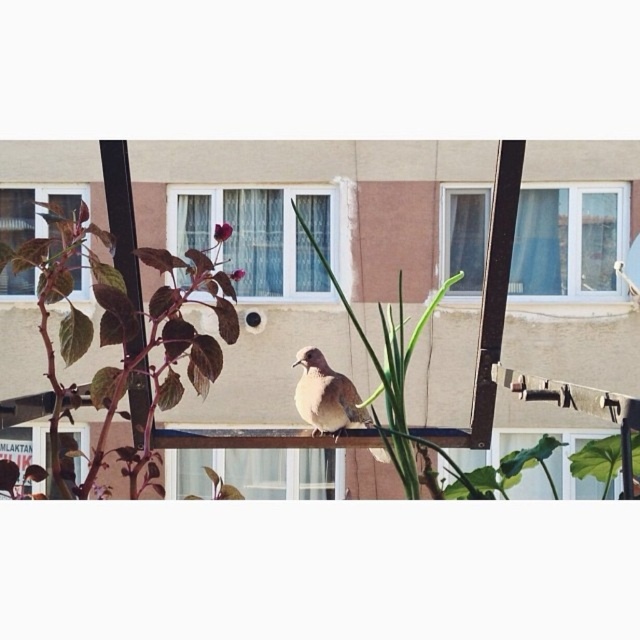
The height and width of the screenshot is (640, 640). What do you see at coordinates (120, 339) in the screenshot? I see `shiny purple leaves at left` at bounding box center [120, 339].

Between point (102, 296) and point (392, 394), which one is positioned in front?

Point (102, 296)

The height and width of the screenshot is (640, 640). I want to click on shiny purple leaves at left, so tap(120, 339).

Does point (218, 372) come closer to viewer compared to point (342, 397)?

That is True.

Does point (81, 234) lie behind point (305, 412)?

No, it is not.

Image resolution: width=640 pixels, height=640 pixels. I want to click on shiny purple leaves at left, so 120,339.

Which is behind, point (364, 336) or point (333, 413)?

The point (333, 413) is behind.

Can you confirm if green leafy plant at center is taller than brown speckled bird at center?

No, green leafy plant at center is not taller than brown speckled bird at center.

Identify the location of green leafy plant at center. This screenshot has height=640, width=640. (396, 384).